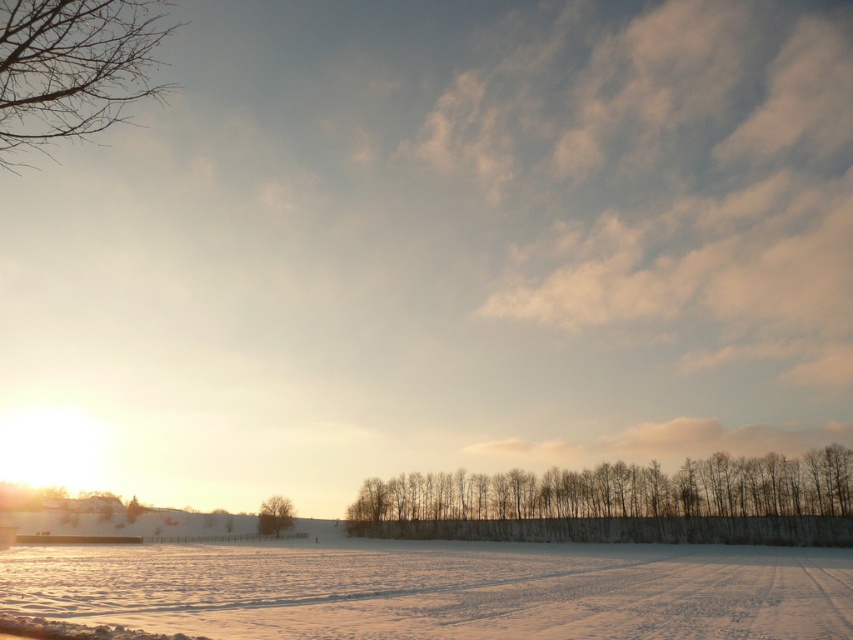
Question: Which of the following is the closest to the observer?

Choices:
 (A) click(100, 26)
 (B) click(283, 500)
 (C) click(728, 634)
 (D) click(502, 474)

Answer: (A)

Question: Is white powdery snow at lower center bigger than snowy bare trees at lower center?

Choices:
 (A) no
 (B) yes

Answer: (B)

Question: Which point is farther from the camera taking this photo?

Choices:
 (A) (102, 1)
 (B) (265, 518)
 (C) (387, 616)
 (D) (386, 524)

Answer: (B)

Question: Which of these objects is positioned farthest from the green matte tree at center?

Choices:
 (A) snowy bare trees at lower center
 (B) bare branches at upper left

Answer: (B)

Question: Can you confirm if white powdery snow at lower center is positioned to the right of green matte tree at center?

Choices:
 (A) no
 (B) yes

Answer: (B)

Question: Does white powdery snow at lower center come in front of green matte tree at center?

Choices:
 (A) no
 (B) yes

Answer: (B)